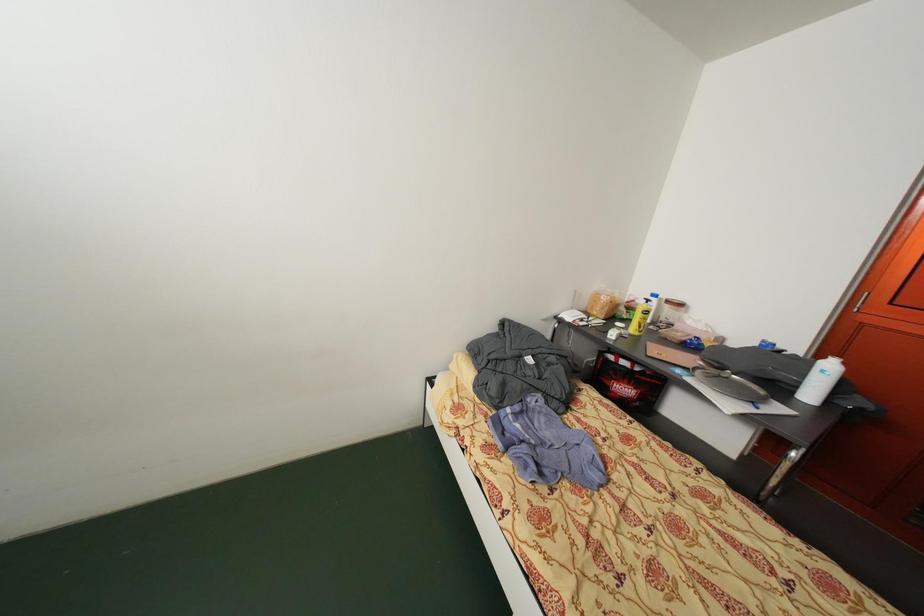
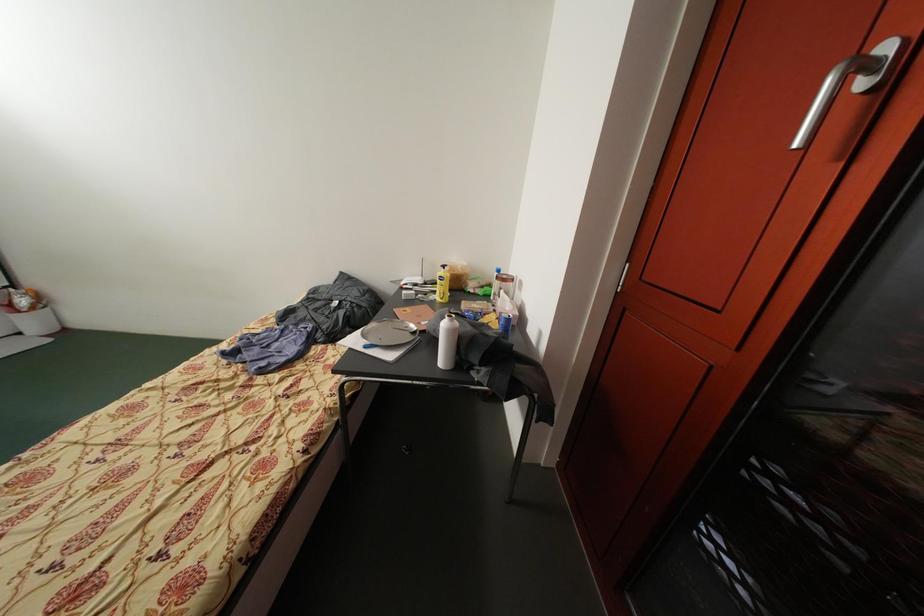
Question: The images are taken continuously from a first-person perspective. In which direction are you moving?

Choices:
 (A) Left
 (B) Right
 (C) Forward
 (D) Backward

Answer: (B)